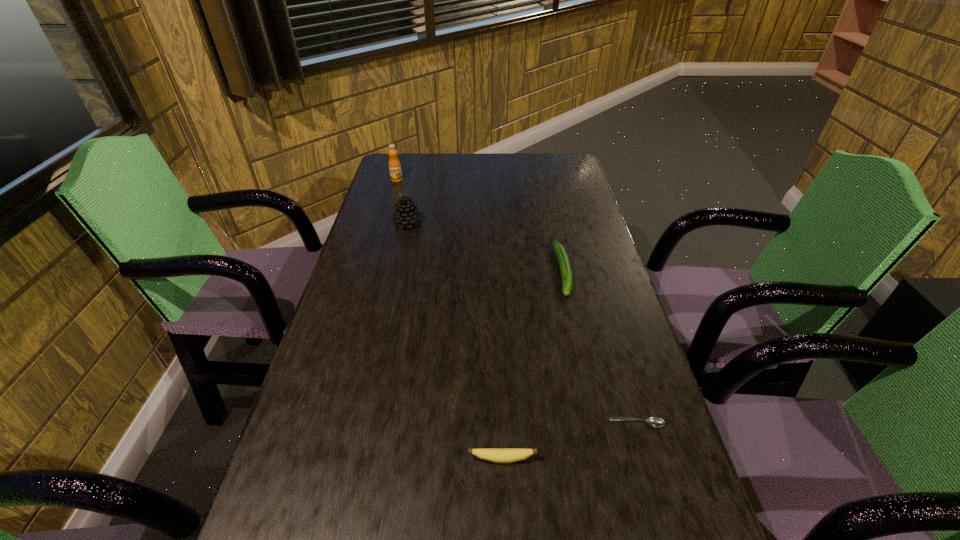
Locate an element on the screen. This screenshot has height=540, width=960. the farthest object is located at coordinates (394, 164).

The width and height of the screenshot is (960, 540). Find the location of `the leftmost object`. the leftmost object is located at coordinates (394, 164).

The width and height of the screenshot is (960, 540). Find the location of `the fourth shortest object`. the fourth shortest object is located at coordinates (406, 214).

The image size is (960, 540). I want to click on the second object from left to right, so click(406, 214).

You are a GUI agent. You are given a task and a screenshot of the screen. Output one action in this format:
    pyautogui.click(x=<x>, y=<y>)
    Task: Click on the banana
    Image resolution: width=960 pixels, height=540 pixels.
    Given the screenshot: What is the action you would take?
    pyautogui.click(x=496, y=455)

I want to click on the nearest object, so click(x=496, y=455).

Identify the location of the fourth object from left to right. This screenshot has width=960, height=540. (566, 272).

You are a GUI agent. You are given a task and a screenshot of the screen. Output one action in this format:
    pyautogui.click(x=<x>, y=<y>)
    Task: Click on the zucchini
    The width and height of the screenshot is (960, 540).
    Given the screenshot: What is the action you would take?
    pyautogui.click(x=566, y=272)

You are a GUI agent. You are given a task and a screenshot of the screen. Output one action in this format:
    pyautogui.click(x=<x>, y=<y>)
    Task: Click on the second nearest object
    The image size is (960, 540).
    Given the screenshot: What is the action you would take?
    pyautogui.click(x=656, y=422)

I want to click on the rightmost object, so click(x=656, y=422).